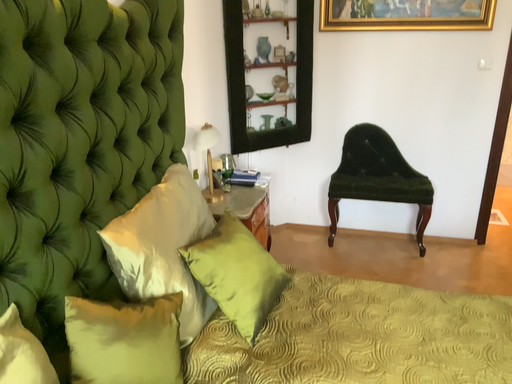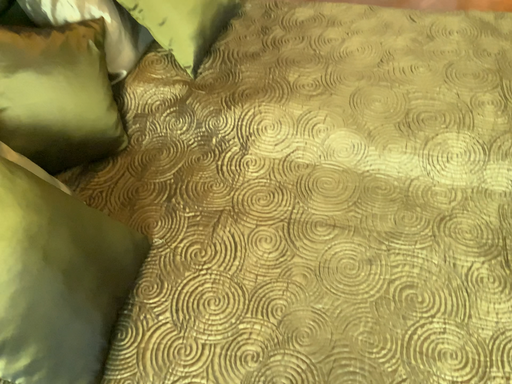
Question: How did the camera likely rotate when shooting the video?

Choices:
 (A) rotated upward
 (B) rotated downward

Answer: (B)